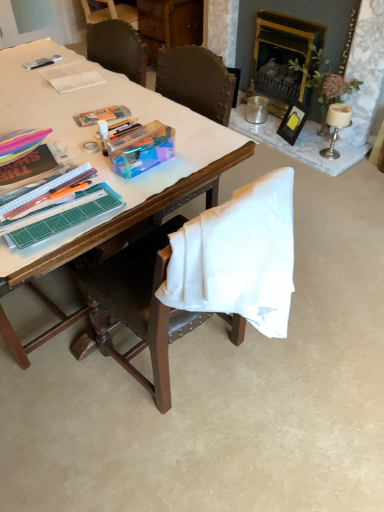
What are the coordinates of `free space above wooden desk at center (from a real-world perspective)` in the screenshot? It's located at (72, 102).